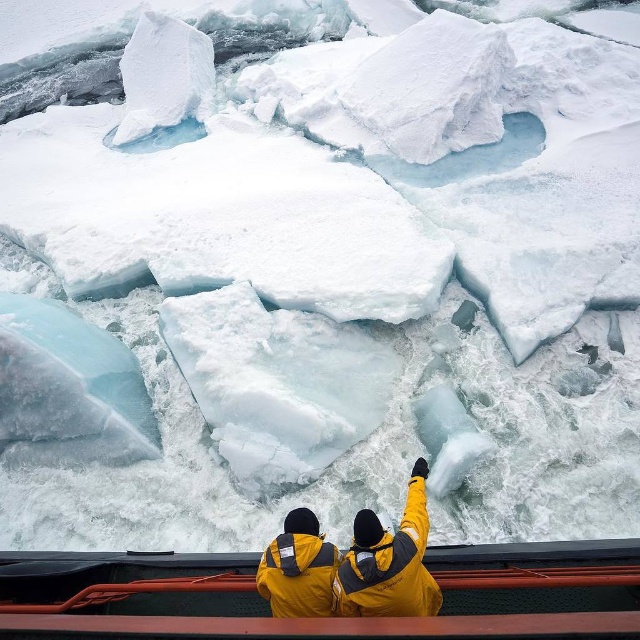
You are a photographer on a boat in a polar region. You want to take a photo of the ice formations in the distance. The yellow matte jacket at center and the orange metal rail at lower center are in your camera frame. Which object in the frame is taller?

The yellow matte jacket at center is much taller than the orange metal rail at lower center, so the yellow matte jacket at center appears taller in the photo.

You are a photographer standing on the boat and want to take a photo of the orange metal rail at lower center. If your camera can focus on objects up to 7 meters away, will you be able to capture the rail clearly?

The orange metal rail at lower center and camera are 7.11 meters apart. Since the camera can focus up to 7 meters, the distance is slightly beyond its range, so the rail may not be in focus.